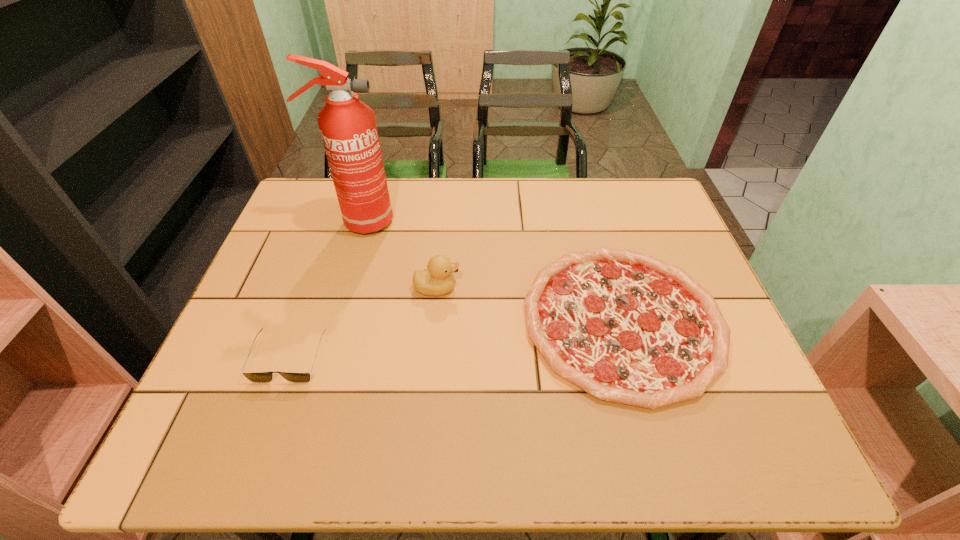
Locate an element on the screen. This screenshot has height=540, width=960. fire extinguisher is located at coordinates (348, 128).

Identify the location of the farthest object. This screenshot has height=540, width=960. (348, 128).

You are a GUI agent. You are given a task and a screenshot of the screen. Output one action in this format:
    pyautogui.click(x=<x>, y=<y>)
    Task: Click on the third shortest object
    
    Given the screenshot: What is the action you would take?
    pyautogui.click(x=438, y=280)

Locate an element on the screen. Image resolution: width=960 pixels, height=540 pixels. duckling is located at coordinates (438, 280).

Locate an element on the screen. the second shortest object is located at coordinates (257, 377).

At what (x,y) coordinates should I click in order to perform the action: click on the rightmost object. Please return your answer as a coordinate pair (x, y). Image resolution: width=960 pixels, height=540 pixels. Looking at the image, I should click on (626, 327).

The width and height of the screenshot is (960, 540). I want to click on the shortest object, so click(x=626, y=327).

Identify the location of free space located at the nozzle of the farthest object. (451, 222).

Identify the location of free spot located on the face of the third object from left to right. (602, 288).

The width and height of the screenshot is (960, 540). Identify the location of vacant space situated on the front-facing side of the sunglasses. (252, 464).